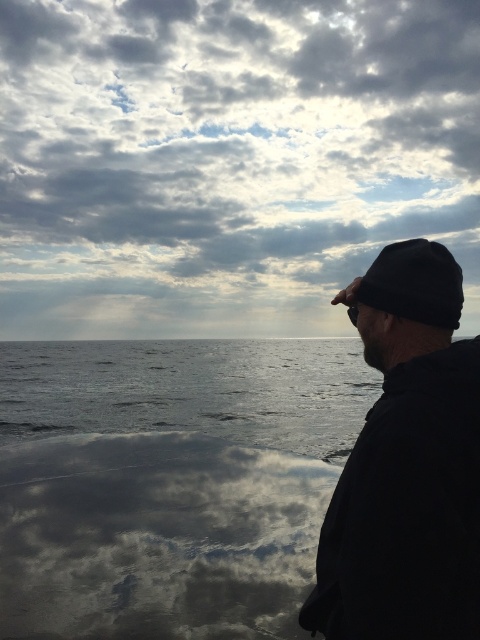
Question: Is cloudy sky at upper center closer to camera compared to black matte beanie at right?

Choices:
 (A) yes
 (B) no

Answer: (B)

Question: Among these points, which one is nearest to the camera?

Choices:
 (A) (66, 80)
 (B) (355, 582)

Answer: (B)

Question: Observing the image, what is the correct spatial positioning of cloudy sky at upper center in reference to black matte beanie at right?

Choices:
 (A) below
 (B) above

Answer: (B)

Question: Is cloudy sky at upper center thinner than black matte beanie at right?

Choices:
 (A) no
 (B) yes

Answer: (A)

Question: Which object is farther from the camera taking this photo?

Choices:
 (A) black matte beanie at right
 (B) cloudy sky at upper center

Answer: (B)